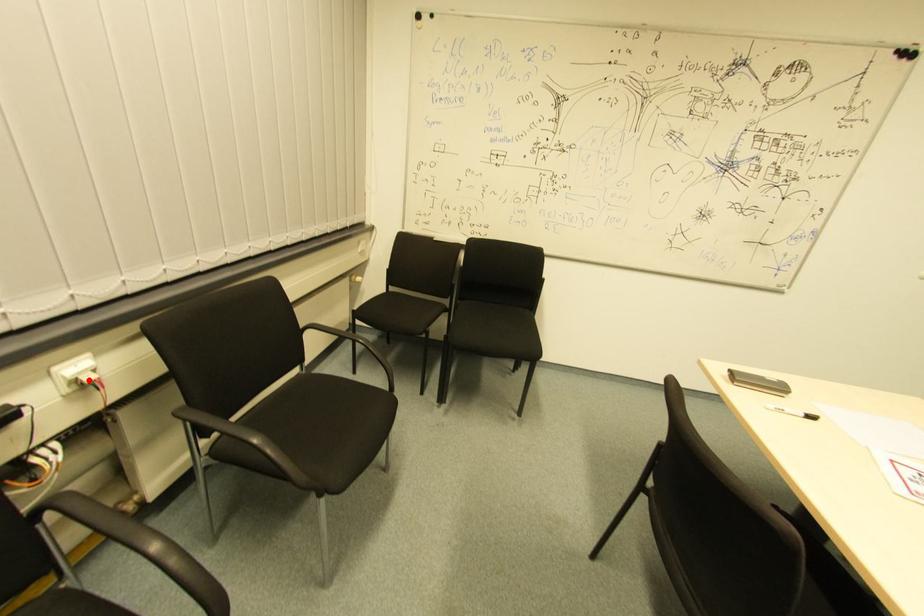
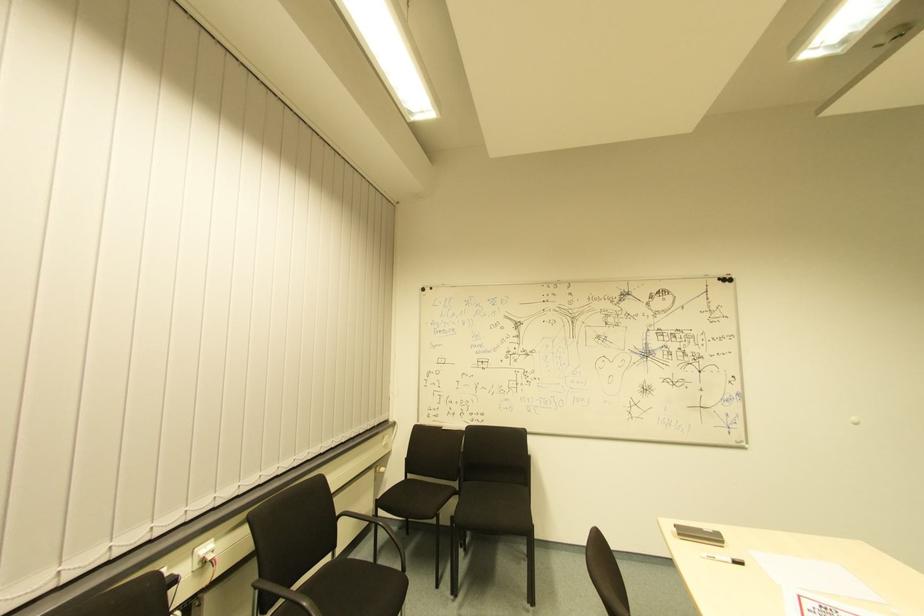
Find the pixel in the second image that matches the highlighted location in the first image.

(208, 561)